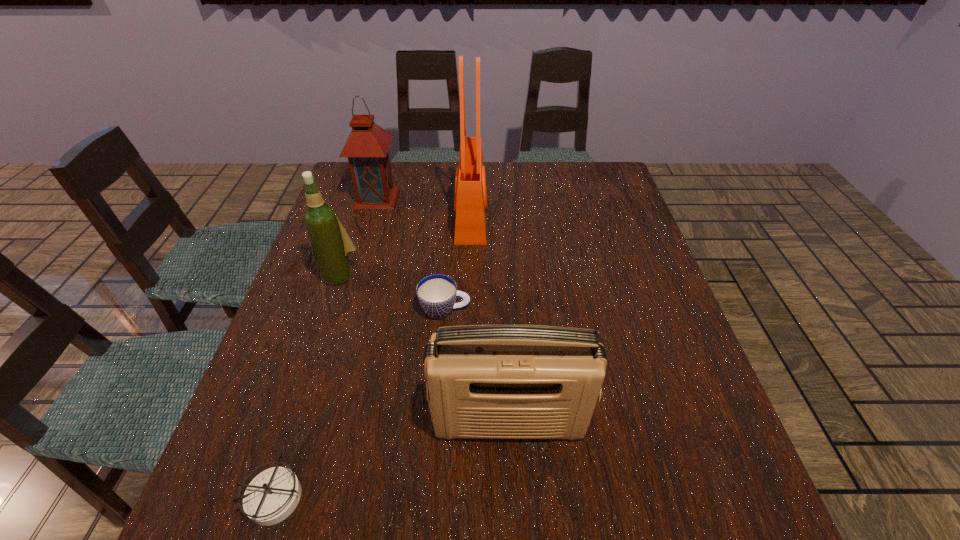
What are the coordinates of `the tallest object` in the screenshot? It's located at (470, 204).

Find the location of a particular element. This screenshot has height=540, width=960. lantern is located at coordinates pyautogui.click(x=367, y=146).

Identify the location of the third farthest object. The width and height of the screenshot is (960, 540). (331, 245).

You are a GUI agent. You are given a task and a screenshot of the screen. Output one action in this format:
    pyautogui.click(x=<x>, y=<y>)
    Task: Click on the radio receiver
    
    Given the screenshot: What is the action you would take?
    pyautogui.click(x=482, y=381)

At what (x,y) coordinates should I click in order to perform the action: click on cup. Please return your answer as a coordinate pair (x, y). Looking at the image, I should click on (436, 293).

You are a GUI agent. You are given a task and a screenshot of the screen. Output one action in this format:
    pyautogui.click(x=<x>, y=<y>)
    Task: Click on the nearest object
    This screenshot has height=540, width=960.
    Given the screenshot: What is the action you would take?
    pyautogui.click(x=272, y=495)

At what (x,y) coordinates should I click in order to perform the action: click on compass. Please return your answer as a coordinate pair (x, y). Looking at the image, I should click on (272, 495).

Locate an element on the screen. vacant region located 0.200m on the logo side of the tallest object is located at coordinates (553, 216).

Find the location of a particular element. Image resolution: width=960 pixels, height=540 pixels. vacant space positioned on the right of the lantern is located at coordinates (450, 197).

The width and height of the screenshot is (960, 540). I want to click on vacant space located 0.340m on the front-facing side of the wine bottle, so click(x=294, y=411).